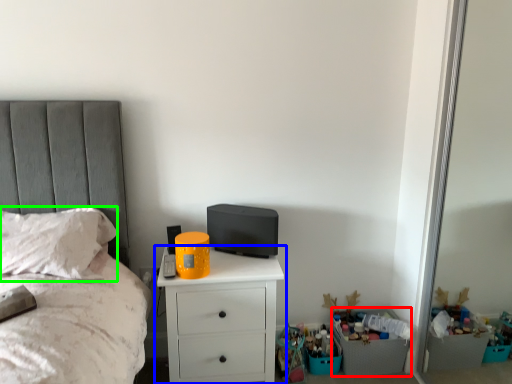
Question: Which object is positioned farthest from crate (highlighted by a red box)? Select from chest of drawers (highlighted by a blue box) and pillow (highlighted by a green box).

Choices:
 (A) chest of drawers
 (B) pillow

Answer: (B)